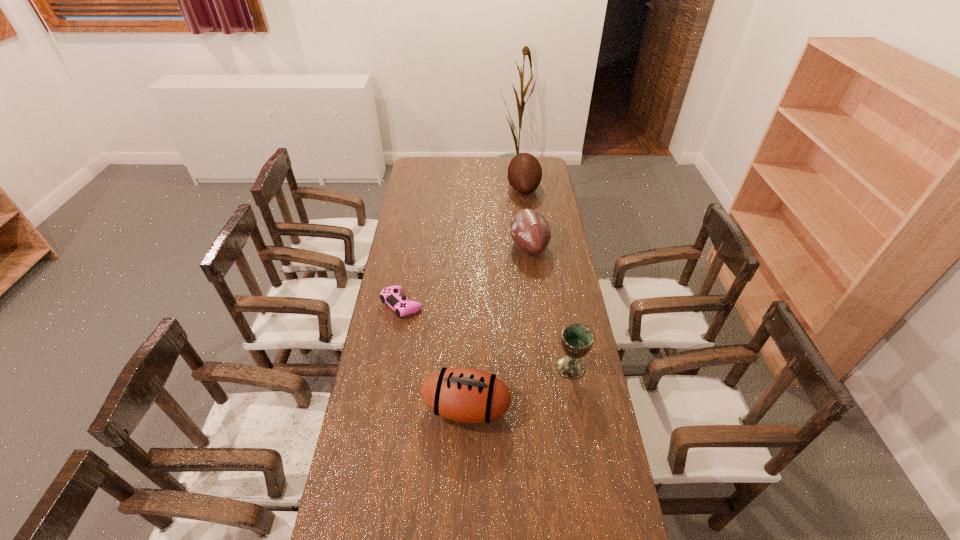
Where is `free space at the right edge of the desktop`? free space at the right edge of the desktop is located at coordinates (562, 261).

What are the coordinates of `free space at the far right corner of the desktop` in the screenshot? It's located at (546, 171).

This screenshot has width=960, height=540. What are the coordinates of `vacant point located between the chalice and the second nearest football (American)` in the screenshot? It's located at pos(550,307).

Find the location of a particular element. The height and width of the screenshot is (540, 960). empty space that is in between the fourth farthest object and the farthest object is located at coordinates (547, 278).

You are a GUI agent. You are given a task and a screenshot of the screen. Output one action in this format:
    pyautogui.click(x=<x>, y=<y>)
    Task: Click on the blank region between the farthest object and the second nearest object
    
    Given the screenshot: What is the action you would take?
    pyautogui.click(x=547, y=278)

Find the location of `blank region between the nearest object and the shortest object`. blank region between the nearest object and the shortest object is located at coordinates (434, 356).

Locate an element on the screen. The width and height of the screenshot is (960, 540). free space between the control and the nearest object is located at coordinates (434, 356).

Where is `vacant space that is in between the third farthest object and the farthest object`? Image resolution: width=960 pixels, height=540 pixels. vacant space that is in between the third farthest object and the farthest object is located at coordinates (463, 246).

Locate an element on the screen. The height and width of the screenshot is (540, 960). vacant region between the nearest object and the shortest object is located at coordinates (434, 356).

In order to click on vacant space that is in between the third nearest object and the second farthest object in this screenshot , I will do `click(466, 275)`.